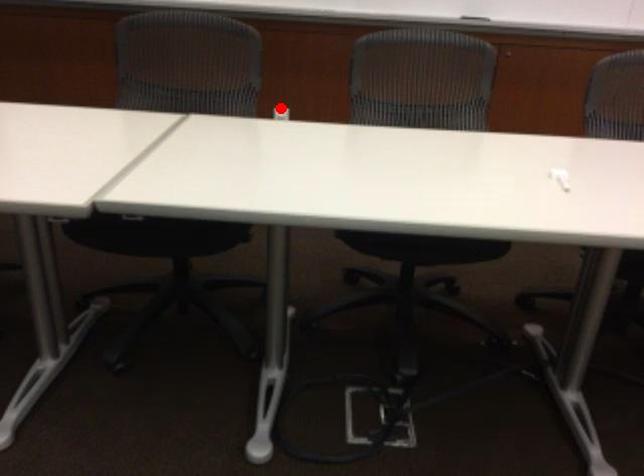
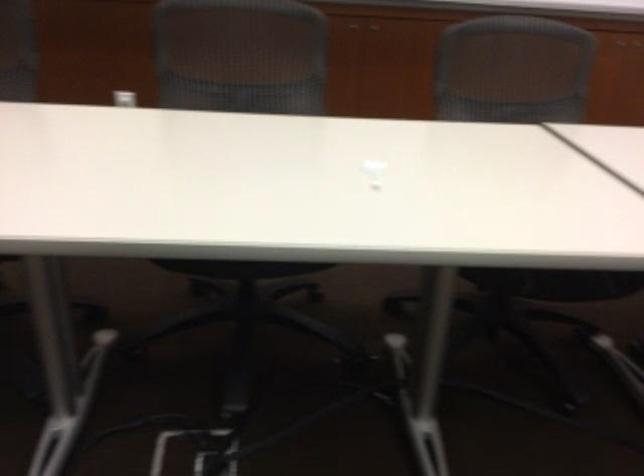
Find the pixel in the second image that matches the highlighted location in the first image.

(125, 96)